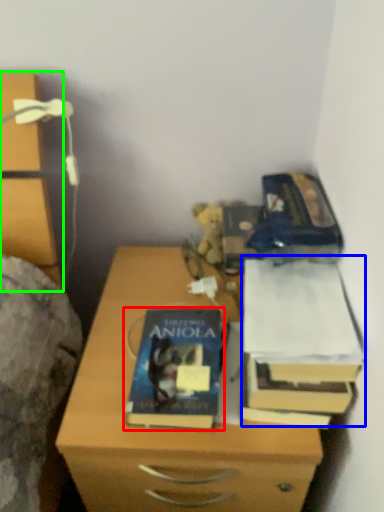
Question: Which is nearer to the book (highlighted by a red box)? paperback book (highlighted by a blue box) or chest of drawers (highlighted by a green box).

Choices:
 (A) paperback book
 (B) chest of drawers

Answer: (A)